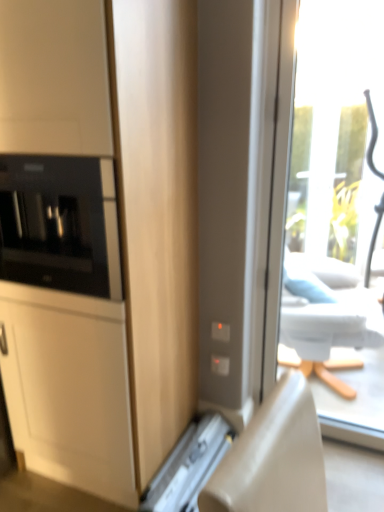
What do you see at coordinates (189, 466) in the screenshot? I see `metallic silver drawer at lower center` at bounding box center [189, 466].

The height and width of the screenshot is (512, 384). I want to click on matte wood cabinet at left, so [98, 236].

Where is `appliance that is on the right side of black glass microwave at left`? The width and height of the screenshot is (384, 512). appliance that is on the right side of black glass microwave at left is located at coordinates (189, 466).

Is black glass microwave at left oriented away from metallic silver drawer at lower center?

No.

Looking at this image, from the image's perspective, between black glass microwave at left and metallic silver drawer at lower center, who is located below?

From the image's view, metallic silver drawer at lower center is below.

Is black glass microwave at left surrounding metallic silver drawer at lower center?

No, metallic silver drawer at lower center is not inside black glass microwave at left.

In the scene shown: From a real-world perspective, who is located higher, metallic silver drawer at lower center or matte wood cabinet at left?

matte wood cabinet at left is physically above.

Considering the relative sizes of metallic silver drawer at lower center and matte wood cabinet at left in the image provided, is metallic silver drawer at lower center taller than matte wood cabinet at left?

No, metallic silver drawer at lower center is not taller than matte wood cabinet at left.

Considering the relative positions of metallic silver drawer at lower center and matte wood cabinet at left in the image provided, is metallic silver drawer at lower center to the left or to the right of matte wood cabinet at left?

In the image, metallic silver drawer at lower center appears on the right side of matte wood cabinet at left.

This screenshot has height=512, width=384. Identify the location of appliance that appears below the matte wood cabinet at left (from a real-world perspective). (189, 466).

The image size is (384, 512). Identify the location of cabinetry on the left of black glass microwave at left. (98, 236).

Can you see black glass microwave at left touching matte wood cabinet at left?

black glass microwave at left and matte wood cabinet at left are clearly separated.

Who is shorter, black glass microwave at left or matte wood cabinet at left?

black glass microwave at left.

From the image's perspective, which one is positioned higher, black glass microwave at left or matte wood cabinet at left?

From the image's view, black glass microwave at left is above.

In the image, is matte wood cabinet at left positioned in front of or behind black glass microwave at left?

matte wood cabinet at left is in front of black glass microwave at left.

From the image's perspective, between matte wood cabinet at left and black glass microwave at left, who is located below?

matte wood cabinet at left.

Is matte wood cabinet at left bigger than black glass microwave at left?

Correct, matte wood cabinet at left is larger in size than black glass microwave at left.

Considering the relative sizes of matte wood cabinet at left and metallic silver drawer at lower center in the image provided, is matte wood cabinet at left thinner than metallic silver drawer at lower center?

Yes, matte wood cabinet at left is thinner than metallic silver drawer at lower center.

Could you tell me if matte wood cabinet at left is turned towards metallic silver drawer at lower center?

No, matte wood cabinet at left is not oriented towards metallic silver drawer at lower center.

Does matte wood cabinet at left have a lesser height compared to metallic silver drawer at lower center?

No.

Is the surface of matte wood cabinet at left in direct contact with metallic silver drawer at lower center?

No, matte wood cabinet at left is not beside metallic silver drawer at lower center.

How distant is metallic silver drawer at lower center from black glass microwave at left?

They are 38.52 inches apart.

Between metallic silver drawer at lower center and black glass microwave at left, which one has more height?

black glass microwave at left.

Considering the sizes of metallic silver drawer at lower center and black glass microwave at left in the image, is metallic silver drawer at lower center wider or thinner than black glass microwave at left?

metallic silver drawer at lower center is wider than black glass microwave at left.

Locate an element on the screen. appliance behind the black glass microwave at left is located at coordinates (189, 466).

Find the location of `appliance lying behind the black glass microwave at left`. appliance lying behind the black glass microwave at left is located at coordinates (189, 466).

Find the location of a particular element. The image size is (384, 512). appliance below the matte wood cabinet at left (from the image's perspective) is located at coordinates (189, 466).

Considering their positions, is matte wood cabinet at left positioned closer to metallic silver drawer at lower center than black glass microwave at left?

matte wood cabinet at left is positioned closer to the anchor metallic silver drawer at lower center.

Which object lies nearer to the anchor point matte wood cabinet at left, black glass microwave at left or metallic silver drawer at lower center?

black glass microwave at left.

Which object lies further to the anchor point matte wood cabinet at left, metallic silver drawer at lower center or black glass microwave at left?

Among the two, metallic silver drawer at lower center is located further to matte wood cabinet at left.

From the image, which object appears to be farther from black glass microwave at left, matte wood cabinet at left or metallic silver drawer at lower center?

metallic silver drawer at lower center is further to black glass microwave at left.

Based on their spatial positions, is metallic silver drawer at lower center or matte wood cabinet at left further from black glass microwave at left?

Among the two, metallic silver drawer at lower center is located further to black glass microwave at left.

Estimate the real-world distances between objects in this image. Which object is closer to metallic silver drawer at lower center, black glass microwave at left or matte wood cabinet at left?

Among the two, matte wood cabinet at left is located nearer to metallic silver drawer at lower center.

Where is `cabinetry between black glass microwave at left and metallic silver drawer at lower center in the up-down direction`? cabinetry between black glass microwave at left and metallic silver drawer at lower center in the up-down direction is located at coordinates (98, 236).